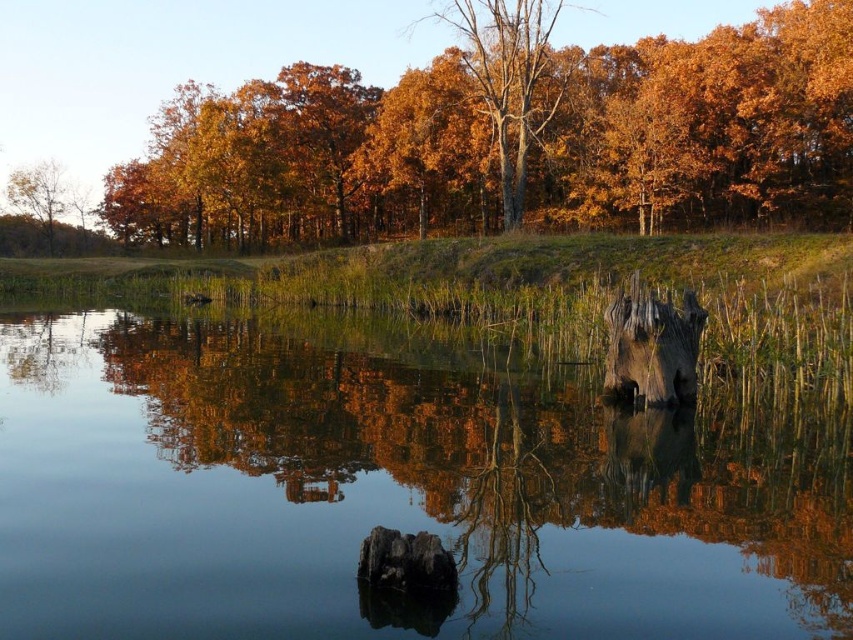
Between smooth water at center and orange matte tree at upper center, which one has less height?

With less height is smooth water at center.

This screenshot has width=853, height=640. Describe the element at coordinates (397, 486) in the screenshot. I see `smooth water at center` at that location.

Is point (241, 529) more distant than point (824, 60)?

No, (241, 529) is in front of (824, 60).

Find the location of a particular element. Image resolution: width=853 pixels, height=640 pixels. smooth water at center is located at coordinates (397, 486).

Which is below, orange matte tree at upper center or golden wood tree at center?

orange matte tree at upper center is lower down.

Can you confirm if orange matte tree at upper center is positioned to the right of golden wood tree at center?

Incorrect, orange matte tree at upper center is not on the right side of golden wood tree at center.

This screenshot has height=640, width=853. Describe the element at coordinates (514, 144) in the screenshot. I see `orange matte tree at upper center` at that location.

You are a GUI agent. You are given a task and a screenshot of the screen. Output one action in this format:
    pyautogui.click(x=<x>, y=<y>)
    Task: Click on the orange matte tree at upper center
    Image resolution: width=853 pixels, height=640 pixels.
    Given the screenshot: What is the action you would take?
    pyautogui.click(x=514, y=144)

Is the position of smooth water at center less distant than that of golden wood tree at center?

Yes, it is.

Between smooth water at center and golden wood tree at center, which one appears on the right side from the viewer's perspective?

golden wood tree at center

Identify the location of smooth water at center. The width and height of the screenshot is (853, 640). (397, 486).

You are a GUI agent. You are given a task and a screenshot of the screen. Output one action in this format:
    pyautogui.click(x=<x>, y=<y>)
    Task: Click on the smooth water at center
    
    Given the screenshot: What is the action you would take?
    pyautogui.click(x=397, y=486)